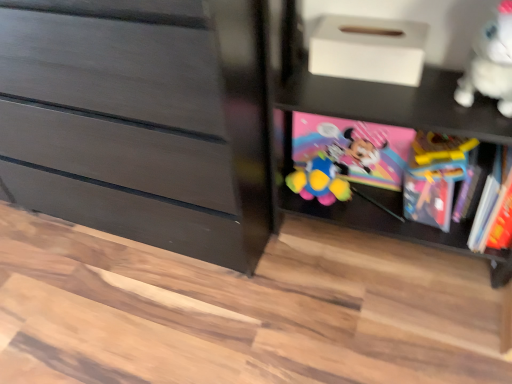
Question: Is translucent plastic book at right, which is the second book from left to right, thinner than matte black dresser at left?

Choices:
 (A) no
 (B) yes

Answer: (B)

Question: Is translucent plastic book at right, which ranks as the first book in right-to-left order, closer to camera compared to matte black dresser at left?

Choices:
 (A) no
 (B) yes

Answer: (A)

Question: From the image's perspective, is translucent plastic book at right, which is the second book from left to right, on matte black dresser at left?

Choices:
 (A) yes
 (B) no

Answer: (B)

Question: Is translucent plastic book at right, which ranks as the first book in right-to-left order, aimed at matte black dresser at left?

Choices:
 (A) yes
 (B) no

Answer: (B)

Question: Considering the relative sizes of translucent plastic book at right, which ranks as the first book in right-to-left order, and matte black dresser at left in the image provided, is translucent plastic book at right, which ranks as the first book in right-to-left order, bigger than matte black dresser at left?

Choices:
 (A) yes
 (B) no

Answer: (B)

Question: Is translucent plastic book at right, which ranks as the first book in right-to-left order, turned away from matte black dresser at left?

Choices:
 (A) no
 (B) yes

Answer: (A)

Question: Does white matte shoe box at upper center have a lesser width compared to white plush toy at upper right?

Choices:
 (A) yes
 (B) no

Answer: (A)

Question: From the image's perspective, does white matte shoe box at upper center appear lower than white plush toy at upper right?

Choices:
 (A) no
 (B) yes

Answer: (A)

Question: From the image's perspective, is white matte shoe box at upper center located above white plush toy at upper right?

Choices:
 (A) yes
 (B) no

Answer: (A)

Question: Can you confirm if white matte shoe box at upper center is bigger than white plush toy at upper right?

Choices:
 (A) yes
 (B) no

Answer: (B)

Question: Is white matte shoe box at upper center aimed at white plush toy at upper right?

Choices:
 (A) yes
 (B) no

Answer: (B)

Question: From a real-world perspective, is white matte shoe box at upper center located beneath white plush toy at upper right?

Choices:
 (A) yes
 (B) no

Answer: (A)

Question: Considering the relative sizes of matte black dresser at left and white plush toy at upper right in the image provided, is matte black dresser at left shorter than white plush toy at upper right?

Choices:
 (A) yes
 (B) no

Answer: (B)